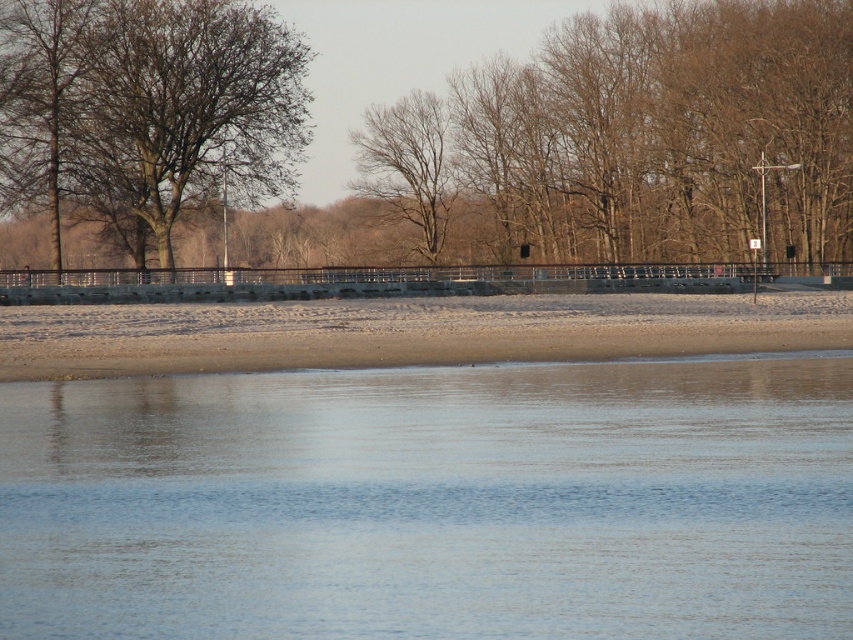
Is clear water at lower center wider than brown leafless tree at upper center?

No, clear water at lower center is not wider than brown leafless tree at upper center.

Is point (367, 513) farther from viewer compared to point (172, 161)?

No, it is in front of (172, 161).

Is point (296, 388) behind point (679, 214)?

No, it is not.

Identify the location of clear water at lower center. This screenshot has width=853, height=640. (433, 500).

Measure the distance between point (381, 529) and camera.

Point (381, 529) is 20.62 meters from camera.

Can you confirm if clear water at lower center is wider than bare branches at left?

Yes, clear water at lower center is wider than bare branches at left.

Locate an element on the screen. clear water at lower center is located at coordinates (x=433, y=500).

At what (x,y) coordinates should I click in order to perform the action: click on clear water at lower center. Please return your answer as a coordinate pair (x, y). This screenshot has width=853, height=640. Looking at the image, I should click on (433, 500).

Which is below, clear water at lower center or bare wood tree at center?

clear water at lower center is below.

What do you see at coordinates (433, 500) in the screenshot? The width and height of the screenshot is (853, 640). I see `clear water at lower center` at bounding box center [433, 500].

Between point (381, 467) and point (421, 182), which one is positioned in front?

Point (381, 467)

This screenshot has height=640, width=853. I want to click on clear water at lower center, so click(x=433, y=500).